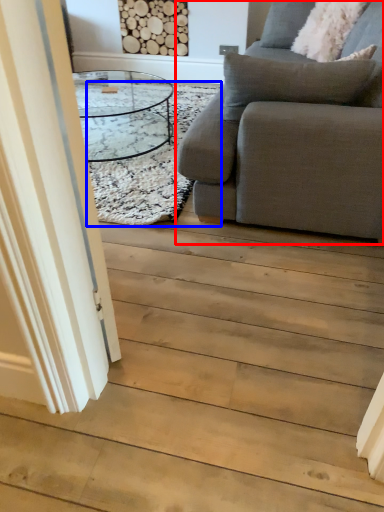
Question: Which object is closer to the camera taking this photo, studio couch (highlighted by a red box) or mat (highlighted by a blue box)?

Choices:
 (A) studio couch
 (B) mat

Answer: (A)